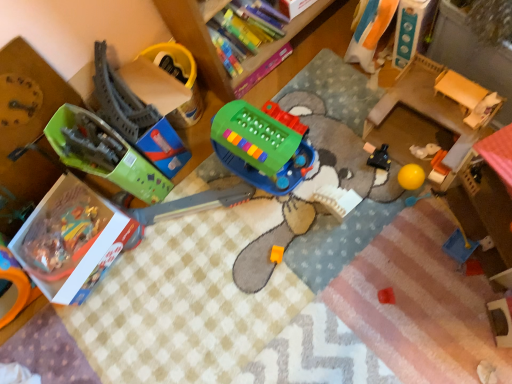
You are a GUI agent. You are given a task and a screenshot of the screen. Output one action in this format:
    pyautogui.click(x=<x>, y=<y>)
    Task: Click on the space that is in front of wooden bookshelf at upper center
    
    Given the screenshot: What is the action you would take?
    pyautogui.click(x=321, y=137)